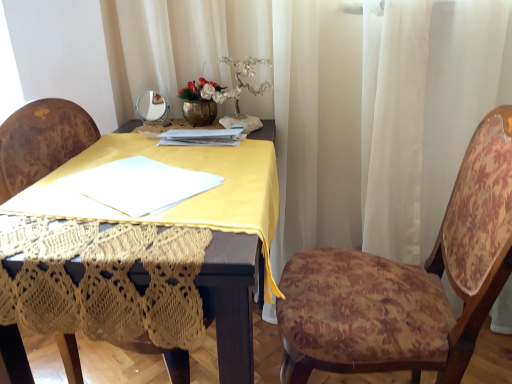
Question: Can you confirm if velvet floral chair at center, positioned as the 1th chair in left-to-right order, is bigger than white sheer curtain at upper center?

Choices:
 (A) no
 (B) yes

Answer: (A)

Question: Considering the relative sizes of velvet floral chair at center, arranged as the 2th chair when viewed from the right, and white sheer curtain at upper center in the image provided, is velvet floral chair at center, arranged as the 2th chair when viewed from the right, thinner than white sheer curtain at upper center?

Choices:
 (A) yes
 (B) no

Answer: (B)

Question: Does velvet floral chair at center, positioned as the 1th chair in left-to-right order, come behind white sheer curtain at upper center?

Choices:
 (A) no
 (B) yes

Answer: (A)

Question: Considering the relative positions of velvet floral chair at center, arranged as the 2th chair when viewed from the right, and white sheer curtain at upper center in the image provided, is velvet floral chair at center, arranged as the 2th chair when viewed from the right, to the right of white sheer curtain at upper center from the viewer's perspective?

Choices:
 (A) yes
 (B) no

Answer: (B)

Question: Is velvet floral chair at center, arranged as the 2th chair when viewed from the right, surrounding white sheer curtain at upper center?

Choices:
 (A) no
 (B) yes

Answer: (A)

Question: Considering the positions of white sheer curtain at upper center and velvet floral chair at center, positioned as the 1th chair in left-to-right order, in the image, is white sheer curtain at upper center wider or thinner than velvet floral chair at center, positioned as the 1th chair in left-to-right order,?

Choices:
 (A) thin
 (B) wide

Answer: (A)

Question: From a real-world perspective, relative to velvet floral chair at center, positioned as the 1th chair in left-to-right order, is white sheer curtain at upper center vertically above or below?

Choices:
 (A) below
 (B) above

Answer: (B)

Question: From the image's perspective, is white sheer curtain at upper center above or below velvet floral chair at center, positioned as the 1th chair in left-to-right order?

Choices:
 (A) above
 (B) below

Answer: (A)

Question: Is white sheer curtain at upper center in front of or behind velvet floral chair at center, positioned as the 1th chair in left-to-right order, in the image?

Choices:
 (A) behind
 (B) front

Answer: (A)

Question: From a real-world perspective, relative to floral fabric chair at right, which is the 1th chair from right to left, is white sheer curtain at upper center vertically above or below?

Choices:
 (A) above
 (B) below

Answer: (A)

Question: From the image's perspective, is white sheer curtain at upper center above or below floral fabric chair at right, which is the 1th chair from right to left?

Choices:
 (A) above
 (B) below

Answer: (A)

Question: In terms of height, does white sheer curtain at upper center look taller or shorter compared to floral fabric chair at right, the 2th chair positioned from the left?

Choices:
 (A) short
 (B) tall

Answer: (B)

Question: Is white sheer curtain at upper center inside the boundaries of floral fabric chair at right, the 2th chair positioned from the left, or outside?

Choices:
 (A) outside
 (B) inside

Answer: (A)

Question: Considering their positions, is floral fabric chair at right, the 2th chair positioned from the left, located in front of or behind white sheer curtain at upper center?

Choices:
 (A) front
 (B) behind

Answer: (A)

Question: In terms of width, does floral fabric chair at right, the 2th chair positioned from the left, look wider or thinner when compared to white sheer curtain at upper center?

Choices:
 (A) thin
 (B) wide

Answer: (B)